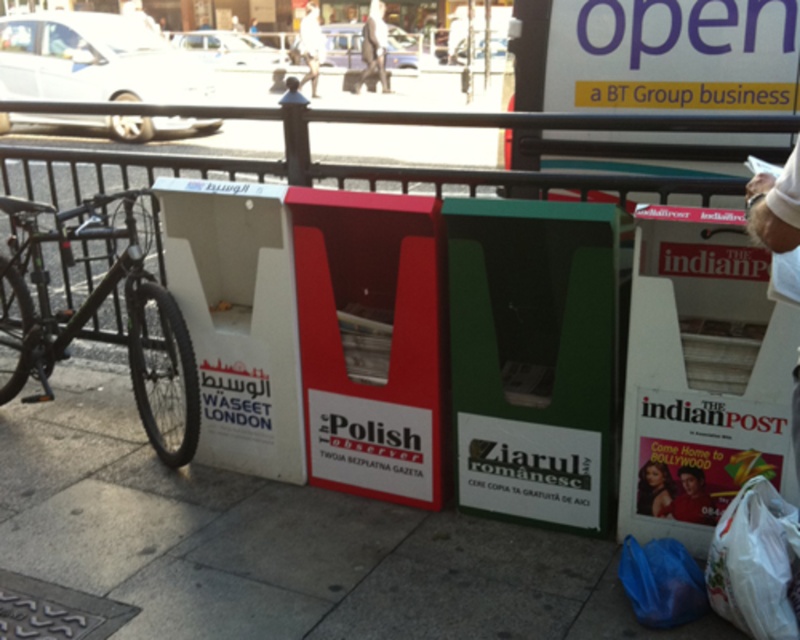
You are standing at the point labeled as point (754, 561) in the image. Which object are you currently standing on?

You are standing on the white plastic bag at lower right.

You are a pedestrian carrying a white plastic bag at lower right and wearing a light beige shirt at upper center. Which item is larger in size?

The light beige shirt at upper center is larger in size than the white plastic bag at lower right.

You are standing on the sidewalk in front of the recycling bins and want to place an object at point (716, 536) and another object at point (770, 182). Which point is closer to you?

Point (716, 536) is closer to you because it is further to the viewer than point (770, 182).